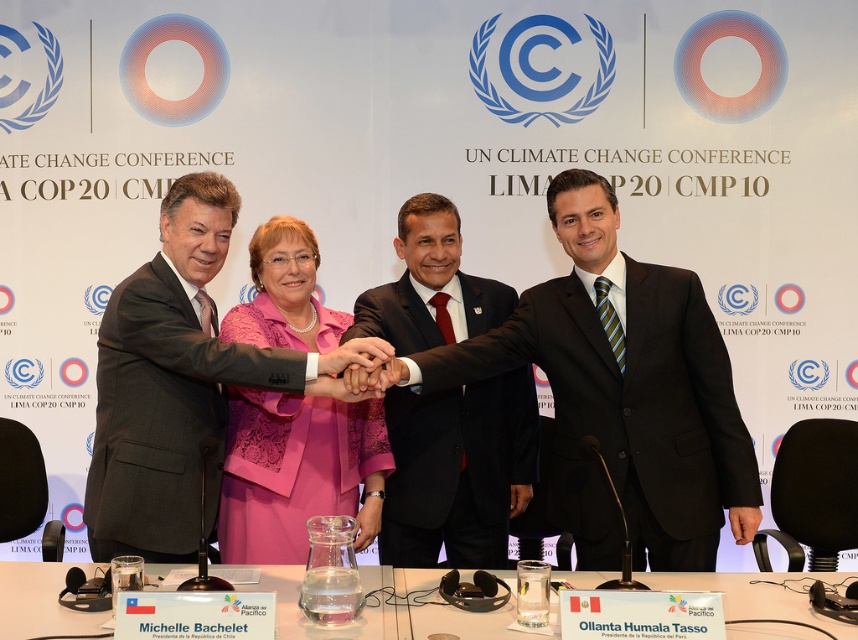
From the picture: You are attending the COP20 Climate Conference in Lima and notice two items at the event venue. One is the pink lace dress at center and the other is the clear plastic water at lower center. Based on their positions, which item is closer to the top of the image?

The pink lace dress at center is located above the clear plastic water at lower center, so it is closer to the top of the image.

At the COP20 event in Lima, two individuals are standing behind a table. One is wearing a matte black suit at center, and the other is in a pink lace dress at center. From the perspective of someone facing the table, which clothing item is positioned lower?

The matte black suit at center is located below the pink lace dress at center, so the matte black suit at center is positioned lower.